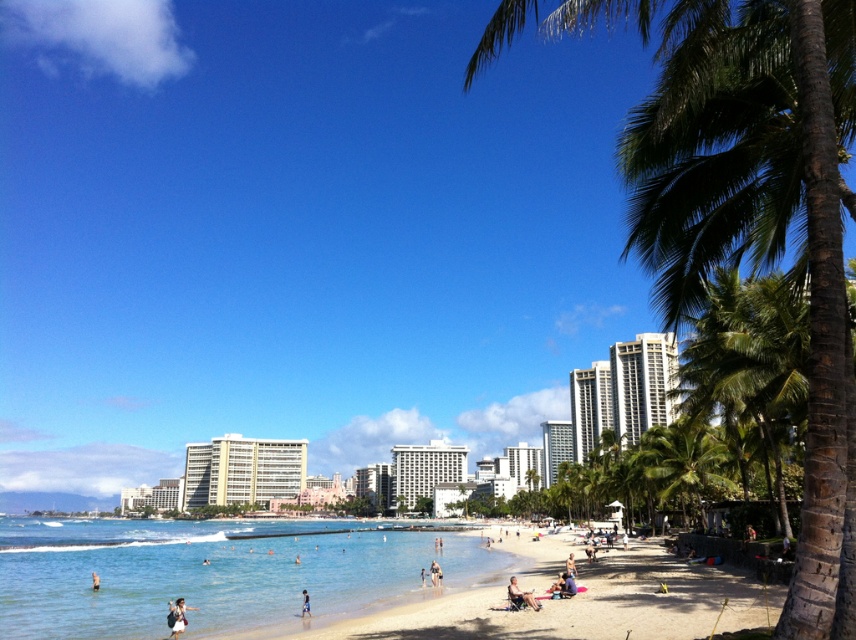
You are standing on the beach and want to locate the clear blue water at beach center. According to the coordinates provided, in which direction should you walk from your current position to reach it?

The clear blue water at beach center is located at coordinates point (204, 573). Since the coordinate system is not specified, it is recommended to walk towards the center of the beach where the water is clear blue.

You are a tour guide planning a group activity on the beach. You need to ensure that the group can hear you clearly while giving instructions. Considering the distance between the clear blue water at beach center and the white glossy hotel at center, which location would be better for you to stand to ensure your voice carries farther? Please explain your reasoning based on the given distance.

The white glossy hotel at center is 183.08 feet away from the clear blue water at beach center. Since sound travels farther over water than through air, standing near the clear blue water at beach center would allow your voice to carry farther. This is because water conducts sound more efficiently than the air around the hotel.